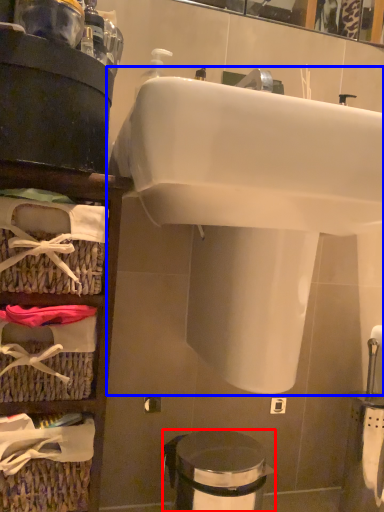
Question: Among these objects, which one is nearest to the camera, trash bin/can (highlighted by a red box) or sink (highlighted by a blue box)?

Choices:
 (A) trash bin/can
 (B) sink

Answer: (B)